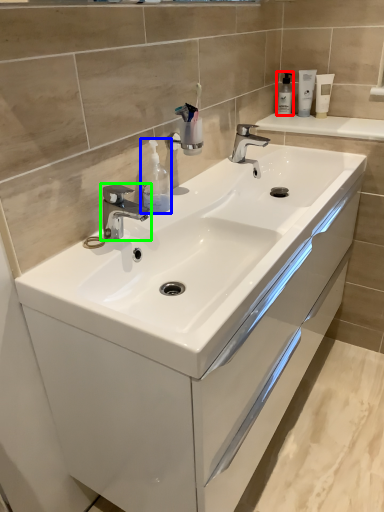
Question: Considering the real-world distances, which object is closest to soap dispenser (highlighted by a red box)? soap dispenser (highlighted by a blue box) or tap (highlighted by a green box).

Choices:
 (A) soap dispenser
 (B) tap

Answer: (A)